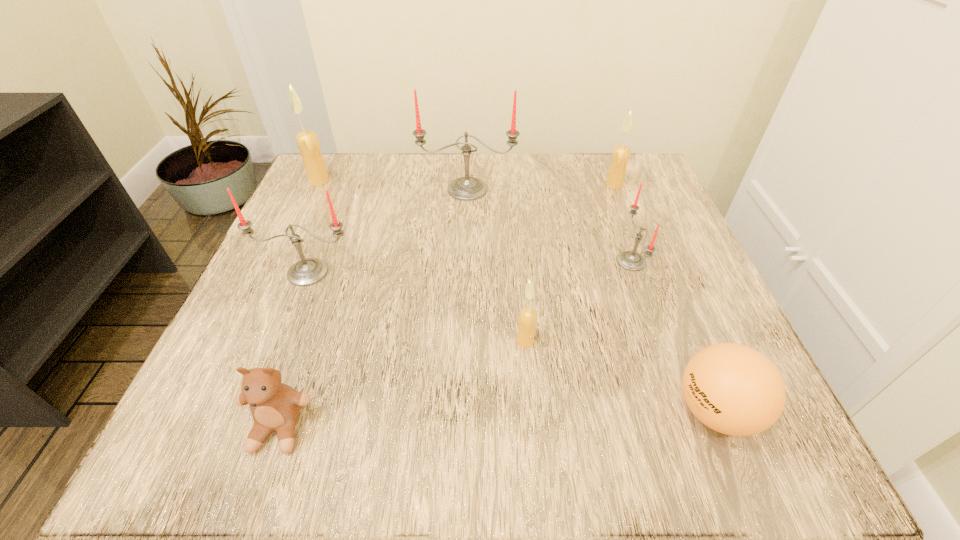
Where is `free point located on the front-facing side of the biggest red candle`? free point located on the front-facing side of the biggest red candle is located at coordinates pyautogui.click(x=464, y=293).

Identify the location of blank space located 0.310m on the right of the biggest cream candle. (465, 180).

The width and height of the screenshot is (960, 540). Identify the location of vacant space located 0.050m on the left of the rightmost cream candle. (584, 185).

Locate an element on the screen. The width and height of the screenshot is (960, 540). vacant area situated 0.150m on the front-facing side of the second smallest red candle is located at coordinates (274, 359).

The image size is (960, 540). I want to click on blank space located 0.240m on the front-facing side of the smallest red candle, so click(487, 261).

In order to click on vacant point located on the front-facing side of the smallest red candle in this screenshot , I will do `click(466, 261)`.

Locate an element on the screen. Image resolution: width=960 pixels, height=540 pixels. vacant region located 0.120m on the front-facing side of the smallest red candle is located at coordinates (552, 261).

In order to click on vacant space located on the right of the smallest cream candle in this screenshot , I will do `click(682, 341)`.

You are a GUI agent. You are given a task and a screenshot of the screen. Output one action in this format:
    pyautogui.click(x=<x>, y=<y>)
    Task: Click on the vacant space located on the side with brand of the ping-pong ball
    This screenshot has width=960, height=540.
    Given the screenshot: What is the action you would take?
    pyautogui.click(x=578, y=411)

I want to click on free spot located on the side with brand of the ping-pong ball, so click(x=468, y=411).